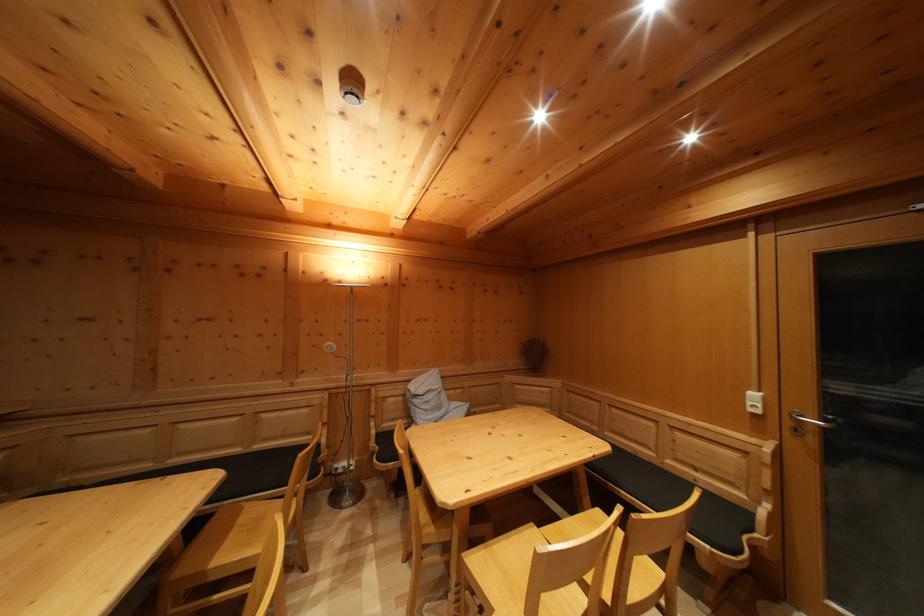
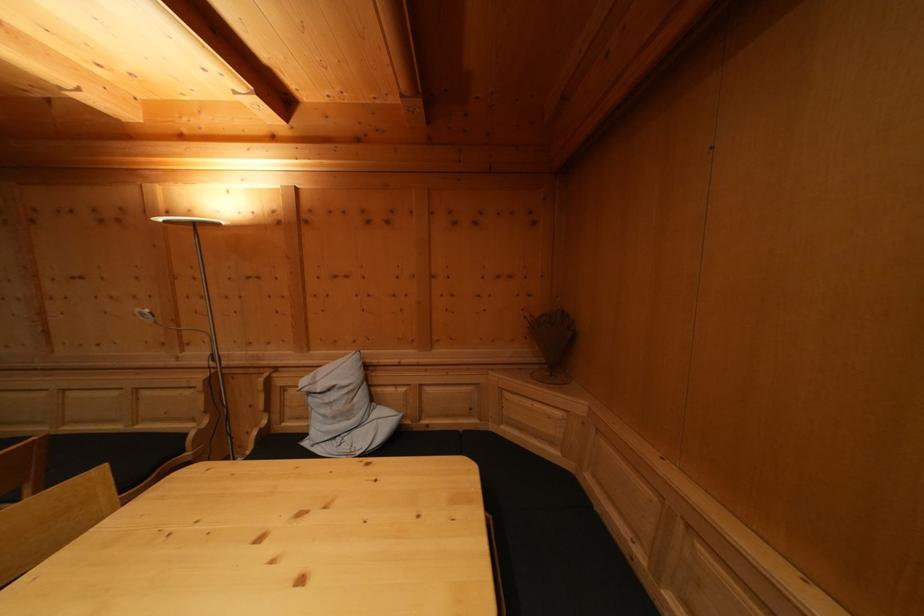
Which direction would the cameraman need to move to produce the second image?

The movement direction of the cameraman is right, forward.